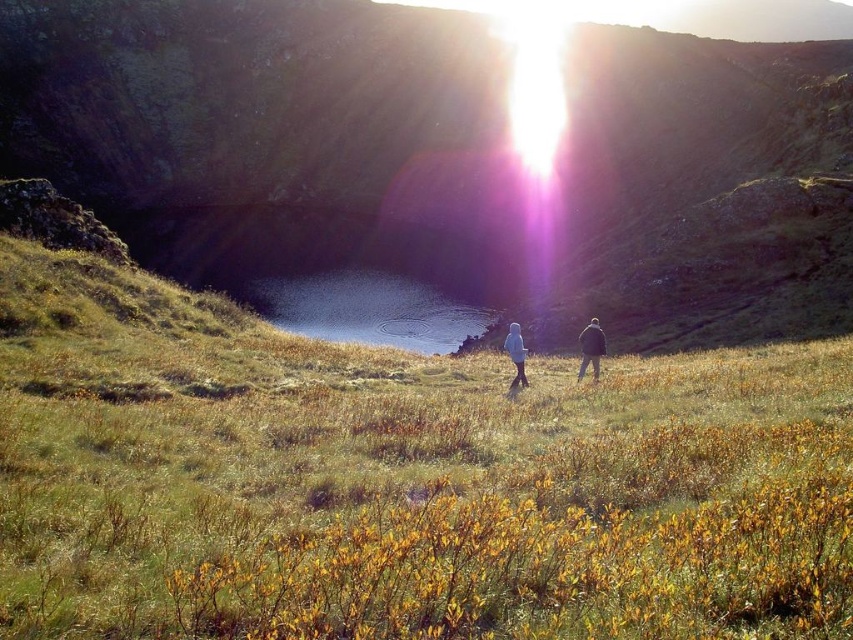
Question: Which object is farther from the camera taking this photo?

Choices:
 (A) green grassy at center
 (B) light blue fabric couple at center
 (C) green grassy hillside at center
 (D) light blue woolen coat at center

Answer: (C)

Question: Which point is farther from the camera taking this photo?

Choices:
 (A) tap(300, 305)
 (B) tap(583, 348)

Answer: (A)

Question: Does green grassy at center have a greater width compared to smooth reflective water at center?

Choices:
 (A) yes
 (B) no

Answer: (A)

Question: Is smooth reflective water at center to the right of dark blue jacket at right from the viewer's perspective?

Choices:
 (A) no
 (B) yes

Answer: (A)

Question: Considering the relative positions of smooth reflective water at center and light blue fabric couple at center in the image provided, where is smooth reflective water at center located with respect to light blue fabric couple at center?

Choices:
 (A) left
 (B) right

Answer: (A)

Question: Considering the real-world distances, which object is farthest from the smooth reflective water at center?

Choices:
 (A) green grassy at center
 (B) dark blue jacket at right
 (C) light blue fabric couple at center
 (D) light blue woolen coat at center

Answer: (D)